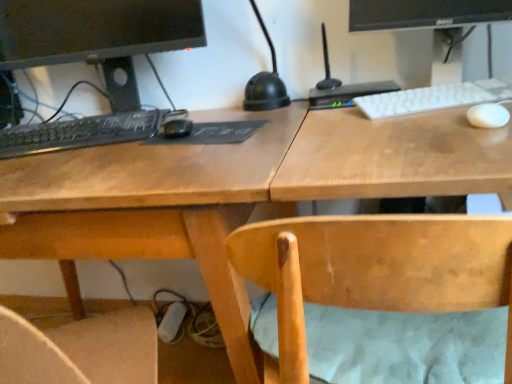
The image size is (512, 384). I want to click on free space in front of black matte keyboard at left, the 2th computer keyboard in the right-to-left sequence, so click(69, 163).